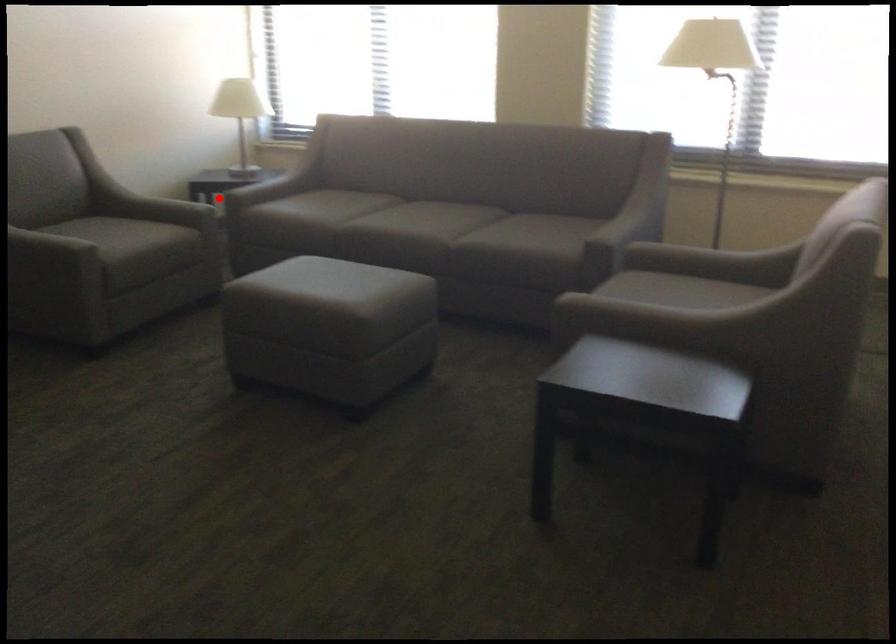
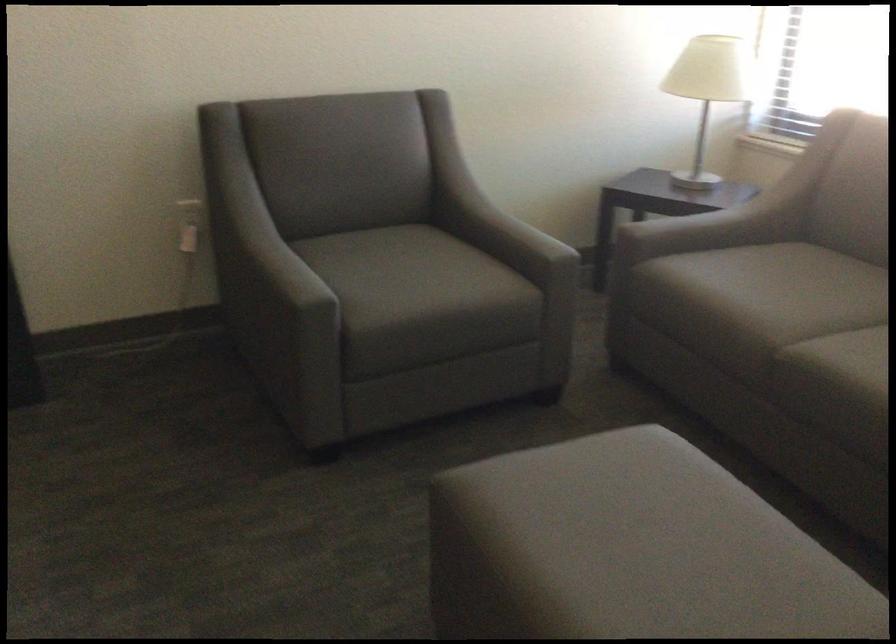
In the second image, find the point that corresponds to the highlighted location in the first image.

(643, 214)